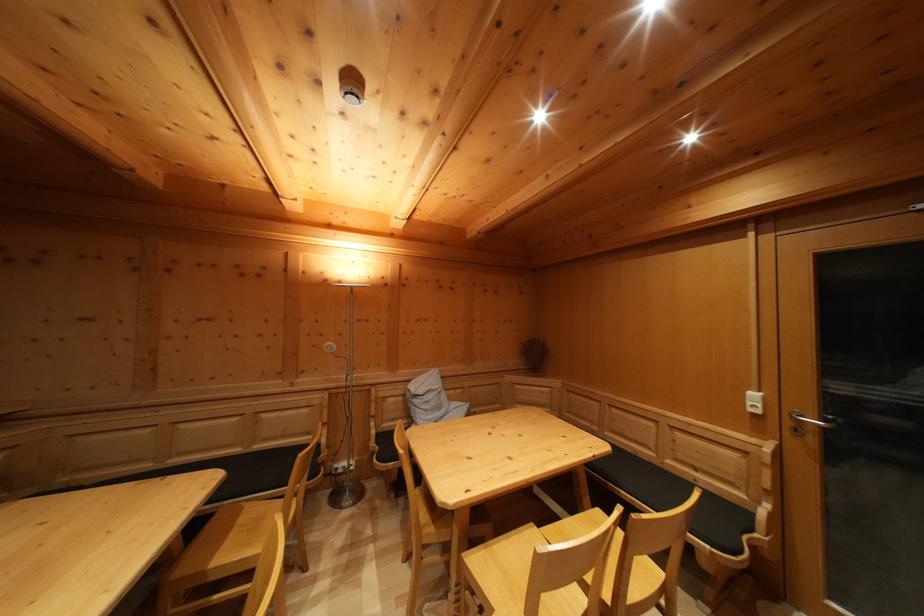
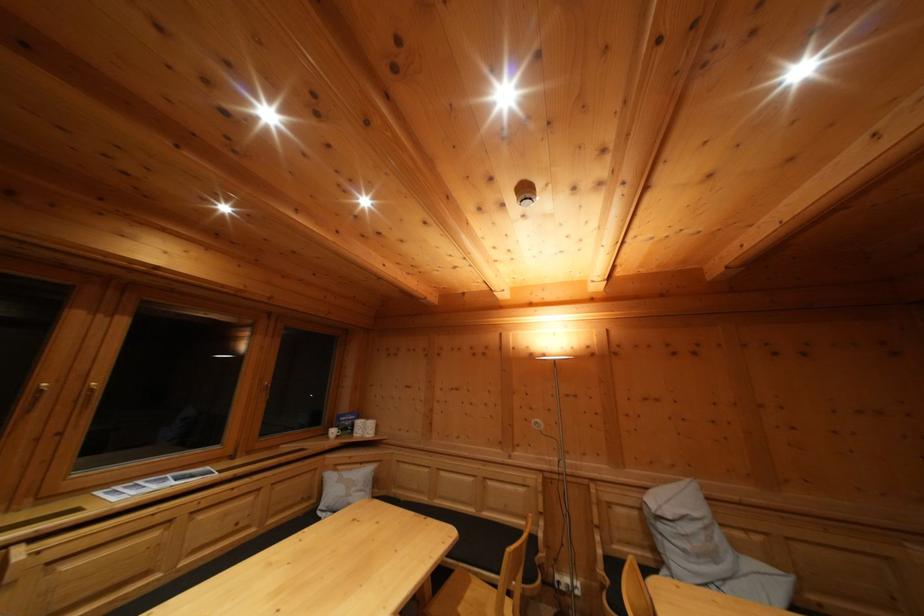
Find the pixel in the second image that matches (x=248, y=525) in the first image.

(475, 601)